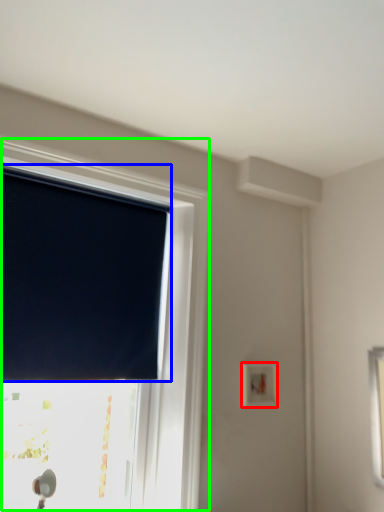
Question: Which object is positioned closest to light switch (highlighted by a red box)? Select from window blind (highlighted by a blue box) and window (highlighted by a green box).

Choices:
 (A) window blind
 (B) window

Answer: (B)